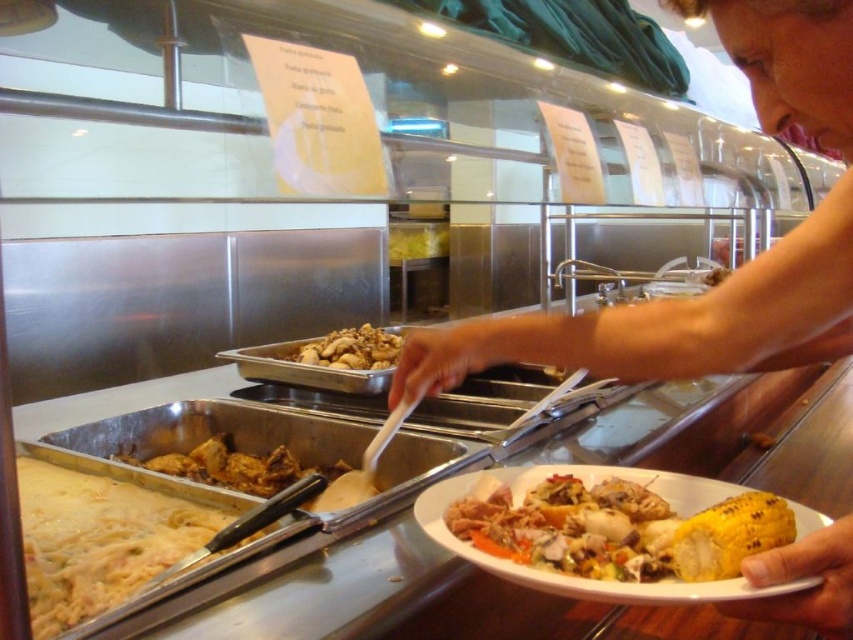
Question: Considering the real-world distances, which object is farthest from the smooth skin hand at center right?

Choices:
 (A) golden brown crispy chicken at center
 (B) white creamy pasta at left
 (C) grilled yellow corn at lower right

Answer: (A)

Question: Is the position of smooth skin hand at center right less distant than that of brown matte chicken at center?

Choices:
 (A) yes
 (B) no

Answer: (A)

Question: Estimate the real-world distances between objects in this image. Which object is farther from the grilled yellow corn at lower right?

Choices:
 (A) smooth skin hand at center right
 (B) white creamy pasta at left

Answer: (B)

Question: Observing the image, what is the correct spatial positioning of smooth skin hand at center right in reference to white creamy pasta at left?

Choices:
 (A) above
 (B) below

Answer: (A)

Question: Which of the following is the closest to the observer?

Choices:
 (A) white creamy pasta at left
 (B) golden brown crispy chicken at center

Answer: (A)

Question: Can you confirm if smooth skin hand at center right is positioned to the right of white creamy pasta at left?

Choices:
 (A) yes
 (B) no

Answer: (A)